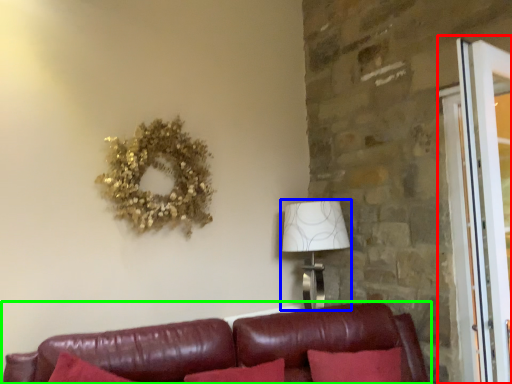
Question: Considering the real-world distances, which object is farthest from screen door (highlighted by a red box)? table lamp (highlighted by a blue box) or studio couch (highlighted by a green box)?

Choices:
 (A) table lamp
 (B) studio couch

Answer: (A)